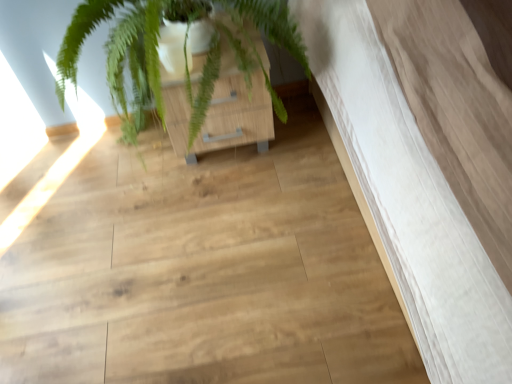
Question: Should I look upward or downward to see wooden cabinet at center?

Choices:
 (A) down
 (B) up

Answer: (B)